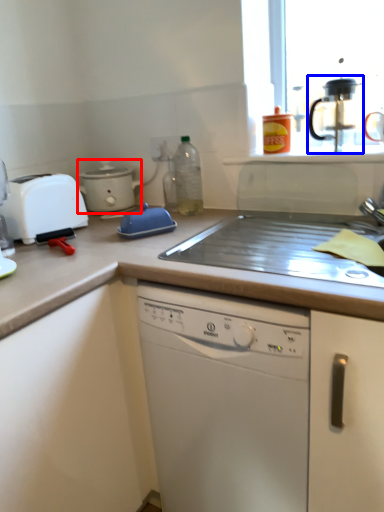
Question: Among these objects, which one is nearest to the camera, kitchen appliance (highlighted by a red box) or coffee machine (highlighted by a blue box)?

Choices:
 (A) kitchen appliance
 (B) coffee machine

Answer: (B)